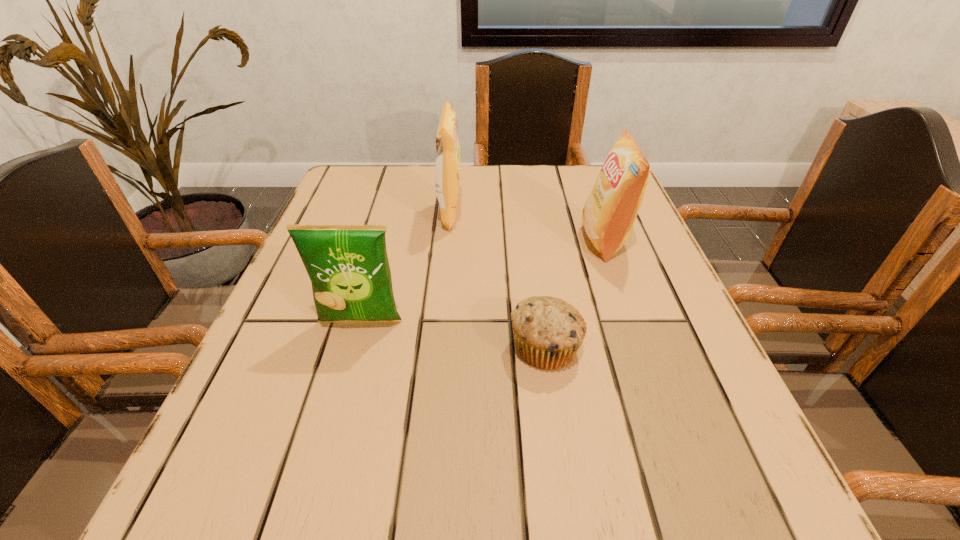
The width and height of the screenshot is (960, 540). In order to click on free space at the far right corner in this screenshot , I will do `click(589, 183)`.

The width and height of the screenshot is (960, 540). In order to click on free space at the near right corner of the desktop in this screenshot , I will do `click(708, 465)`.

Locate an element on the screen. vacant region between the leftmost crisp (potato chip) and the rightmost crisp (potato chip) is located at coordinates (483, 281).

I want to click on free point between the leftmost object and the muffin, so click(453, 334).

I want to click on empty space that is in between the muffin and the rightmost crisp (potato chip), so click(575, 294).

The height and width of the screenshot is (540, 960). In order to click on vacant region between the rightmost object and the second crisp (potato chip) from right to left in this screenshot , I will do `click(527, 227)`.

The height and width of the screenshot is (540, 960). In order to click on free space between the second object from left to right and the leftmost crisp (potato chip) in this screenshot , I will do `click(405, 267)`.

Locate an element on the screen. The height and width of the screenshot is (540, 960). free space between the rightmost object and the third object from right to left is located at coordinates (527, 227).

I want to click on free spot between the rightmost crisp (potato chip) and the second crisp (potato chip) from right to left, so click(527, 227).

You are a GUI agent. You are given a task and a screenshot of the screen. Output one action in this format:
    pyautogui.click(x=<x>, y=<y>)
    Task: Click on the unoccupied area between the rightmost object and the leftmost crisp (potato chip)
    
    Given the screenshot: What is the action you would take?
    pyautogui.click(x=483, y=281)